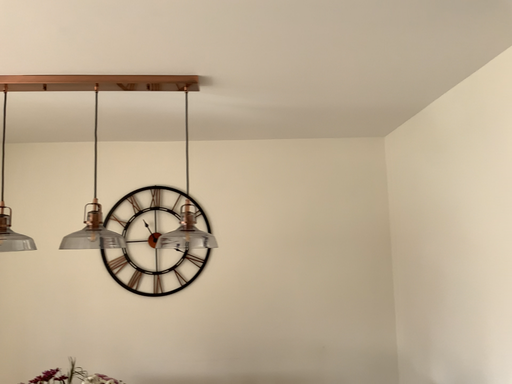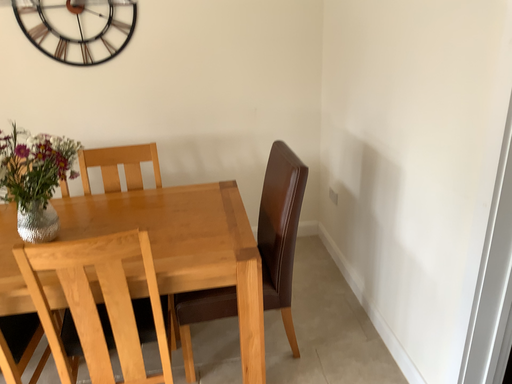
Question: Which way did the camera rotate in the video?

Choices:
 (A) rotated upward
 (B) rotated downward

Answer: (B)